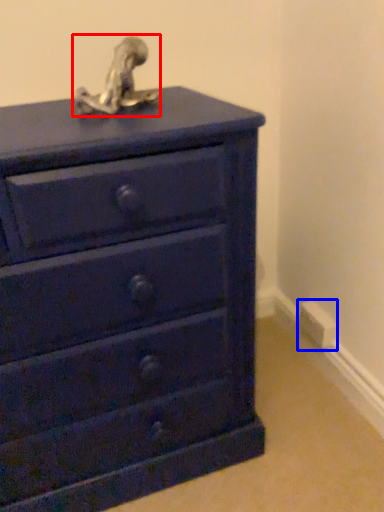
Question: Which of the following is the closest to the observer, sculpture (highlighted by a red box) or electric outlet (highlighted by a blue box)?

Choices:
 (A) sculpture
 (B) electric outlet

Answer: (A)